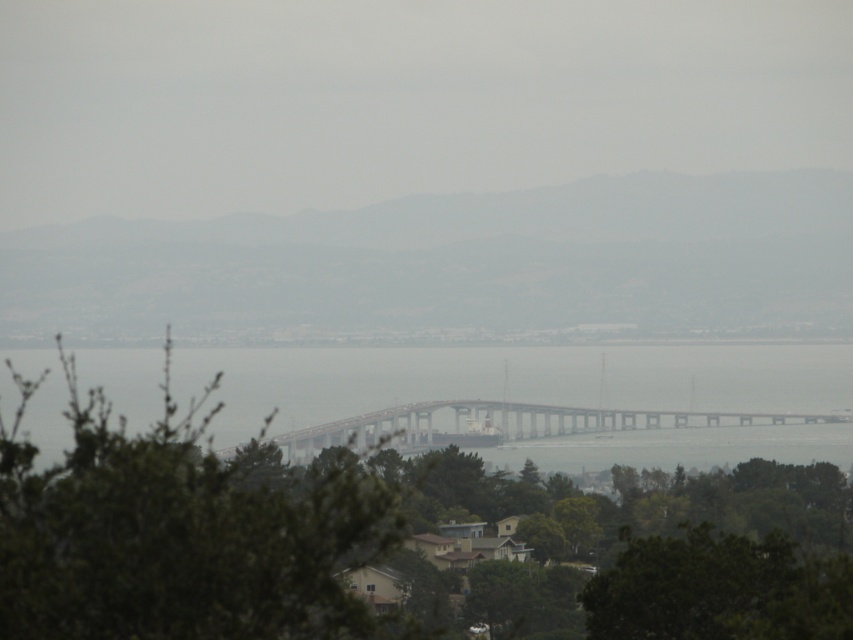
Question: Which of the following is the closest to the observer?

Choices:
 (A) (631, 417)
 (B) (230, 609)

Answer: (B)

Question: Considering the relative positions of clear water at center and metallic gray bridge at center in the image provided, where is clear water at center located with respect to metallic gray bridge at center?

Choices:
 (A) below
 (B) above

Answer: (B)

Question: Considering the real-world distances, which object is farthest from the green leafy tree at center?

Choices:
 (A) metallic gray bridge at center
 (B) clear water at center

Answer: (A)

Question: Does green leafy tree at center come in front of metallic gray bridge at center?

Choices:
 (A) yes
 (B) no

Answer: (A)

Question: Which of these objects is positioned closest to the metallic gray bridge at center?

Choices:
 (A) clear water at center
 (B) green leafy tree at center

Answer: (A)

Question: Can you confirm if green leafy tree at center is smaller than clear water at center?

Choices:
 (A) no
 (B) yes

Answer: (A)